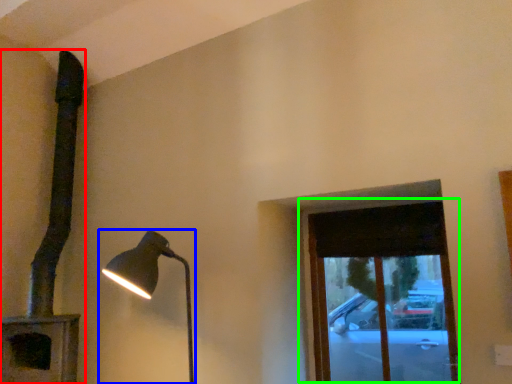
Question: Estimate the real-world distances between objects in this image. Which object is closer to lamp (highlighted by a red box), lamp (highlighted by a blue box) or window (highlighted by a green box)?

Choices:
 (A) lamp
 (B) window

Answer: (A)